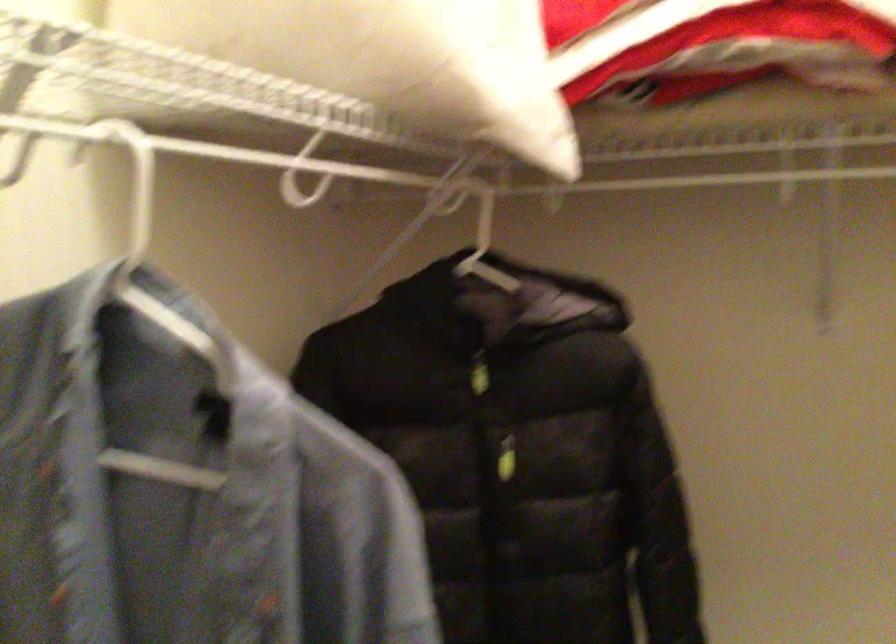
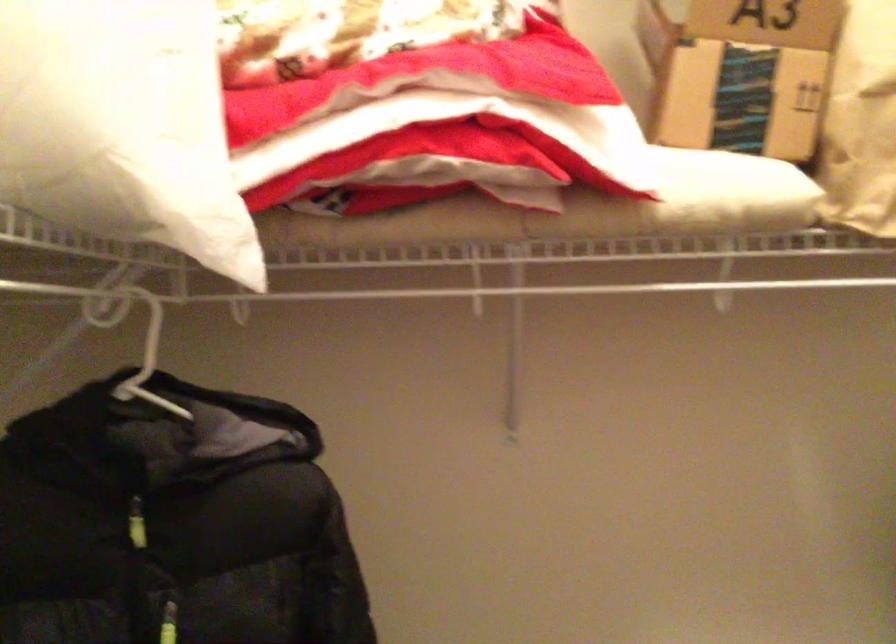
Locate, in the second image, the point that corresponds to [474,377] in the first image.

(136, 524)